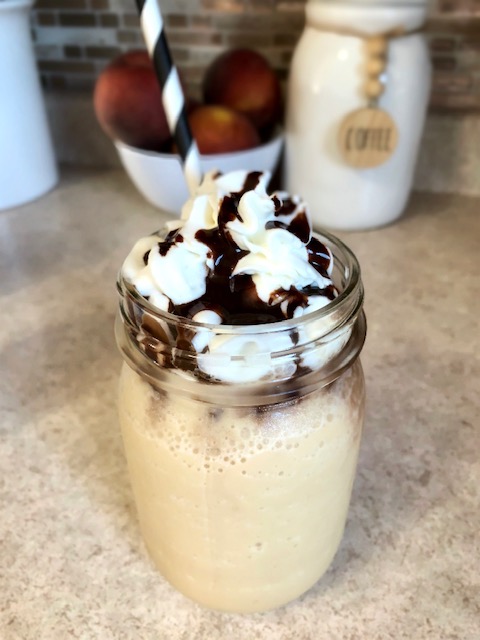
The width and height of the screenshot is (480, 640). In order to click on jars in this screenshot , I will do `click(284, 456)`, `click(340, 93)`, `click(22, 122)`.